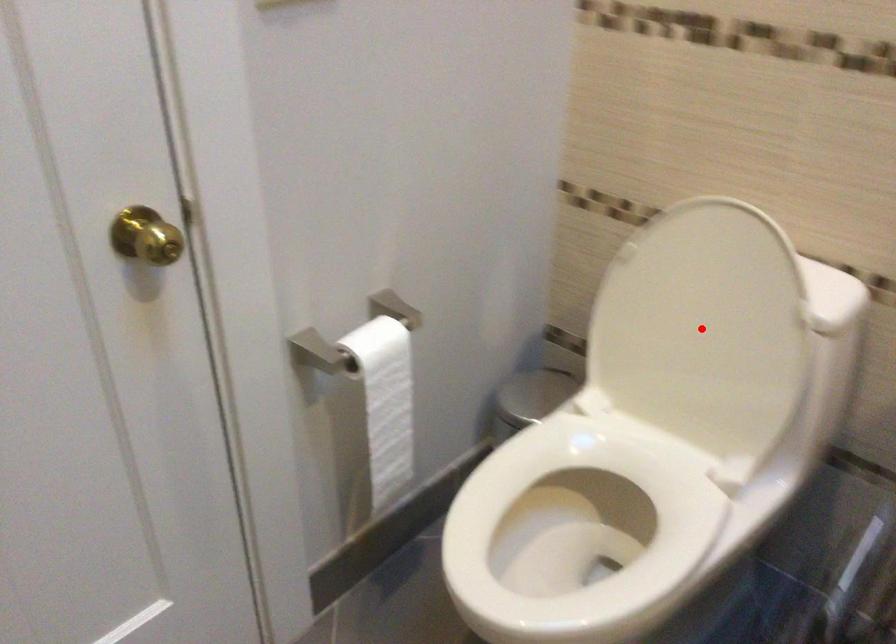
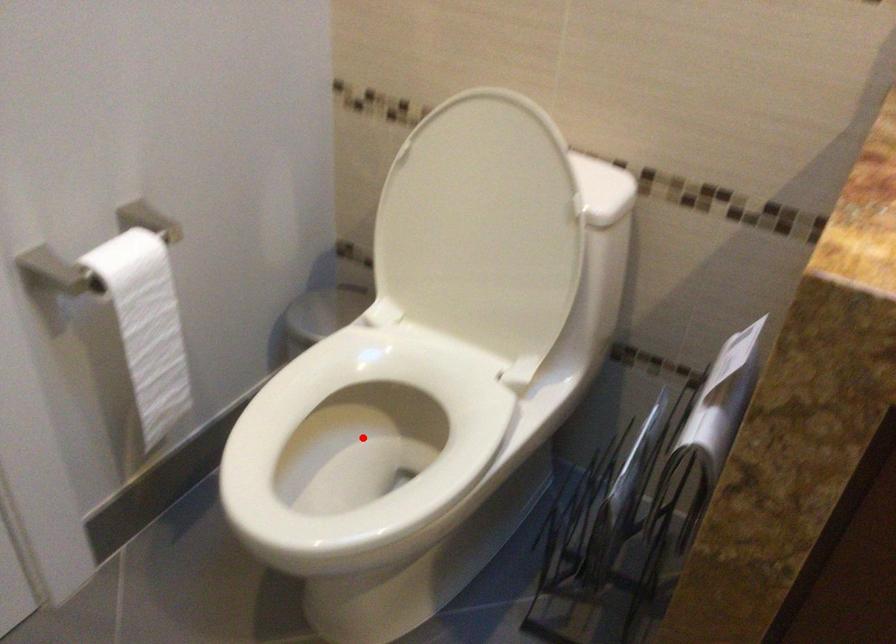
I am providing you with two images of the same scene from different viewpoints. A red point is marked on the first image and another point is marked on the second image. Do the highlighted points in image1 and image2 indicate the same real-world spot?

No